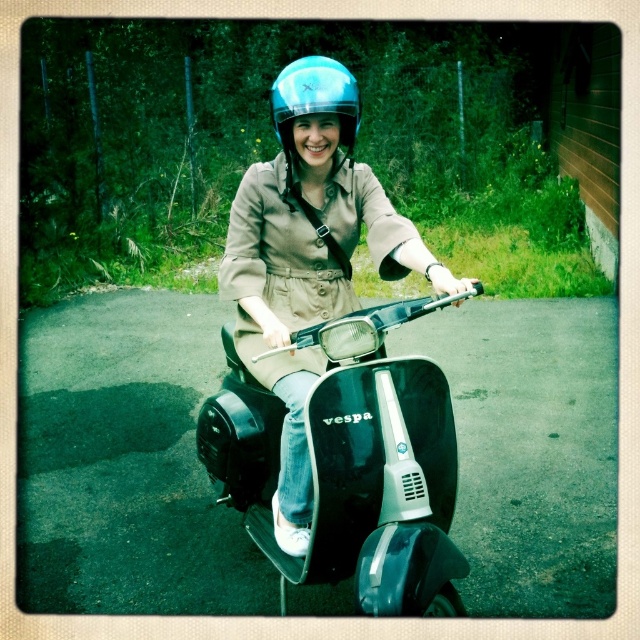
Question: Which object is farther from the camera taking this photo?

Choices:
 (A) matte blue helmet at center
 (B) black glossy vespa at center

Answer: (A)

Question: In this image, where is matte blue helmet at center located relative to blue glossy helmet at center?

Choices:
 (A) below
 (B) above

Answer: (A)

Question: Which of the following is the farthest from the observer?

Choices:
 (A) (308, 385)
 (B) (346, 100)

Answer: (A)

Question: Which object is the farthest from the blue glossy helmet at center?

Choices:
 (A) matte blue helmet at center
 (B) black glossy vespa at center

Answer: (B)

Question: Is the position of black glossy vespa at center more distant than that of matte blue helmet at center?

Choices:
 (A) no
 (B) yes

Answer: (A)

Question: Does black glossy vespa at center appear on the right side of blue glossy helmet at center?

Choices:
 (A) yes
 (B) no

Answer: (B)